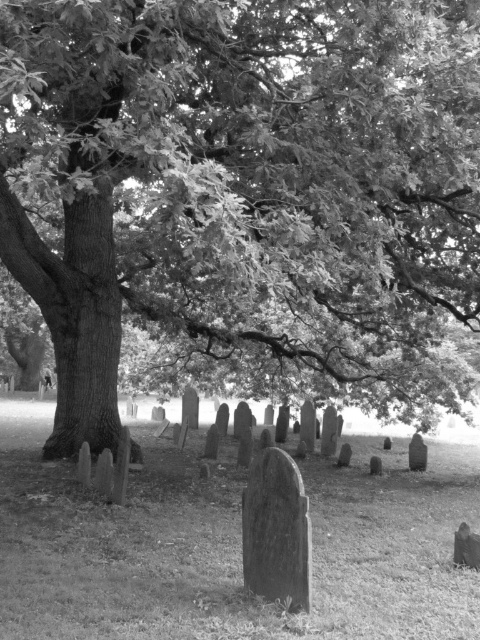
You are standing at the entrance of the cemetery and notice the smooth bark tree at center and the smooth stone gravestone at center. Which object is positioned to the left when facing the cemetery from the entrance?

The smooth bark tree at center is positioned to the left of the smooth stone gravestone at center when facing the cemetery from the entrance.